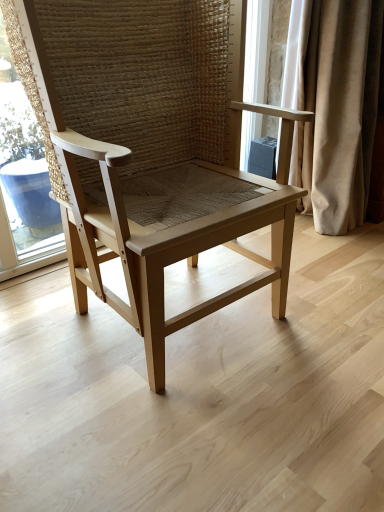
What do you see at coordinates (333, 106) in the screenshot? I see `beige fabric curtain at right` at bounding box center [333, 106].

Where is `beige fabric curtain at right`? The height and width of the screenshot is (512, 384). beige fabric curtain at right is located at coordinates (333, 106).

The width and height of the screenshot is (384, 512). Describe the element at coordinates (152, 152) in the screenshot. I see `light wood chair at center` at that location.

Locate an element on the screen. This screenshot has height=512, width=384. light wood chair at center is located at coordinates (152, 152).

The height and width of the screenshot is (512, 384). In order to click on beige fabric curtain at right in this screenshot , I will do click(333, 106).

Considering the positions of objects beige fabric curtain at right and light wood chair at center in the image provided, who is more to the left, beige fabric curtain at right or light wood chair at center?

light wood chair at center is more to the left.

Is the position of beige fabric curtain at right less distant than that of light wood chair at center?

No, beige fabric curtain at right is further to the viewer.

Which is in front, point (351, 102) or point (116, 213)?

The point (116, 213) is closer to the camera.

From the image's perspective, is beige fabric curtain at right below light wood chair at center?

No.

From a real-world perspective, is beige fabric curtain at right beneath light wood chair at center?

No.

In the scene shown: Which of these two, beige fabric curtain at right or light wood chair at center, is wider?

Wider between the two is light wood chair at center.

In terms of height, does beige fabric curtain at right look taller or shorter compared to light wood chair at center?

Clearly, beige fabric curtain at right is taller compared to light wood chair at center.

Considering the sizes of beige fabric curtain at right and light wood chair at center in the image, is beige fabric curtain at right bigger or smaller than light wood chair at center?

Clearly, beige fabric curtain at right is smaller in size than light wood chair at center.

Is light wood chair at center inside beige fabric curtain at right?

No, light wood chair at center is not surrounded by beige fabric curtain at right.

Is beige fabric curtain at right next to light wood chair at center?

beige fabric curtain at right is not next to light wood chair at center, and they're not touching.

Is beige fabric curtain at right facing towards light wood chair at center?

No, beige fabric curtain at right is not aimed at light wood chair at center.

Locate an element on the screen. chair that appears in front of the beige fabric curtain at right is located at coordinates (152, 152).

Which object is positioned more to the left, light wood chair at center or beige fabric curtain at right?

From the viewer's perspective, light wood chair at center appears more on the left side.

Which object is further away from the camera, light wood chair at center or beige fabric curtain at right?

beige fabric curtain at right is behind.

Between point (99, 162) and point (340, 28), which one is positioned in front?

The point (99, 162) is closer.

From the image's perspective, which one is positioned lower, light wood chair at center or beige fabric curtain at right?

light wood chair at center appears lower in the image.

From a real-world perspective, is light wood chair at center above or below beige fabric curtain at right?

Clearly, from a real-world perspective, light wood chair at center is below beige fabric curtain at right.

Looking at their sizes, would you say light wood chair at center is wider or thinner than beige fabric curtain at right?

Clearly, light wood chair at center has more width compared to beige fabric curtain at right.

Based on the photo, considering the relative sizes of light wood chair at center and beige fabric curtain at right in the image provided, is light wood chair at center shorter than beige fabric curtain at right?

Indeed, light wood chair at center has a lesser height compared to beige fabric curtain at right.

Considering the relative sizes of light wood chair at center and beige fabric curtain at right in the image provided, is light wood chair at center bigger than beige fabric curtain at right?

Yes.

Would you say beige fabric curtain at right is part of light wood chair at center's contents?

No, light wood chair at center does not contain beige fabric curtain at right.

Is light wood chair at center directly adjacent to beige fabric curtain at right?

No, light wood chair at center is not next to beige fabric curtain at right.

In the scene shown: Could you tell me if light wood chair at center is turned towards beige fabric curtain at right?

No, light wood chair at center is not oriented towards beige fabric curtain at right.

This screenshot has height=512, width=384. What are the coordinates of `curtain located on the right of light wood chair at center` in the screenshot? It's located at 333,106.

This screenshot has height=512, width=384. What are the coordinates of `chair to the left of beige fabric curtain at right` in the screenshot? It's located at (152, 152).

Locate an element on the screen. chair below the beige fabric curtain at right (from the image's perspective) is located at coordinates (152, 152).